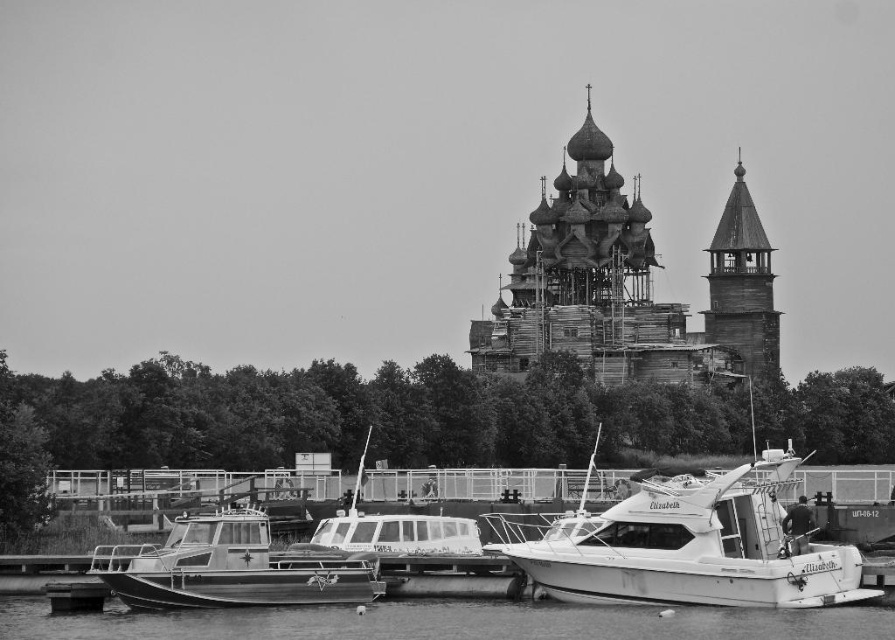
Question: Based on their relative distances, which object is farther from the smooth water at lower center?

Choices:
 (A) wooden tower at upper right
 (B) metallic gray boat at lower left
 (C) wooden church at center

Answer: (A)

Question: Can you confirm if white plastic boat at center is positioned to the left of wooden tower at upper right?

Choices:
 (A) no
 (B) yes

Answer: (B)

Question: Is wooden church at center closer to camera compared to metallic gray boat at lower left?

Choices:
 (A) yes
 (B) no

Answer: (B)

Question: Based on their relative distances, which object is nearer to the white matte boat at center?

Choices:
 (A) white plastic boat at center
 (B) wooden tower at upper right
 (C) metallic gray boat at lower left

Answer: (A)

Question: Which object is the closest to the wooden church at center?

Choices:
 (A) wooden tower at upper right
 (B) metallic gray boat at lower left
 (C) white plastic boat at center

Answer: (A)

Question: Does white matte boat at center have a lesser width compared to smooth water at lower center?

Choices:
 (A) no
 (B) yes

Answer: (B)